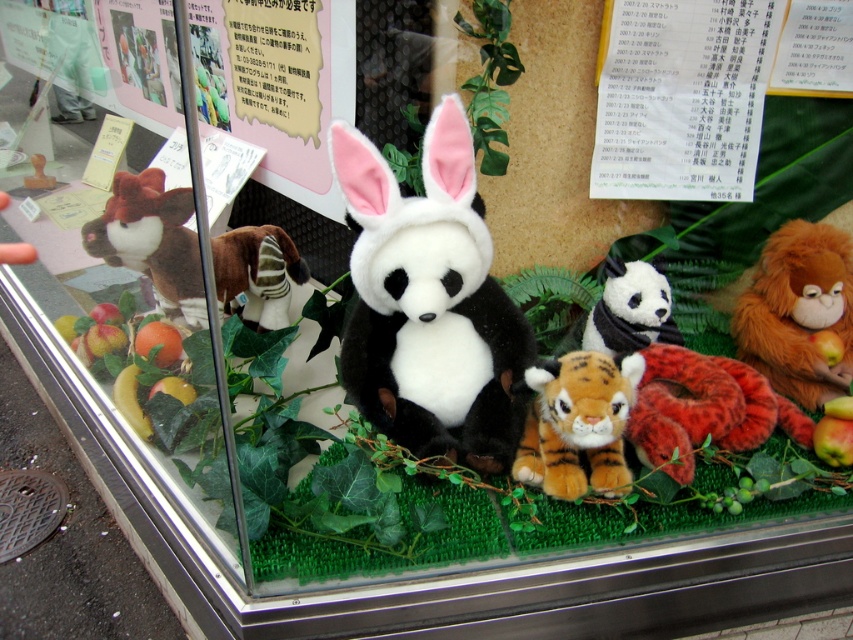
Who is higher up, velvet plush zebra at center or matte black plush panda at center?

velvet plush zebra at center is above.

Which is more to the right, velvet plush zebra at center or matte black plush panda at center?

From the viewer's perspective, matte black plush panda at center appears more on the right side.

Does point (273, 262) lie in front of point (677, 344)?

No, (273, 262) is behind (677, 344).

Identify the location of velvet plush zebra at center. The width and height of the screenshot is (853, 640). (x=257, y=273).

Who is taller, black plush panda at center or orange plush tiger at center?

black plush panda at center

Which is below, black plush panda at center or orange plush tiger at center?

Positioned lower is orange plush tiger at center.

Describe the element at coordinates (428, 301) in the screenshot. I see `black plush panda at center` at that location.

The height and width of the screenshot is (640, 853). I want to click on black plush panda at center, so click(x=428, y=301).

Is the position of orange plush tiger at center less distant than that of matte black plush panda at center?

Yes.

Consider the image. Is orange plush tiger at center taller than matte black plush panda at center?

Indeed, orange plush tiger at center has a greater height compared to matte black plush panda at center.

Does point (531, 435) come closer to viewer compared to point (593, 330)?

Yes, it is.

In order to click on orange plush tiger at center in this screenshot , I will do `click(578, 424)`.